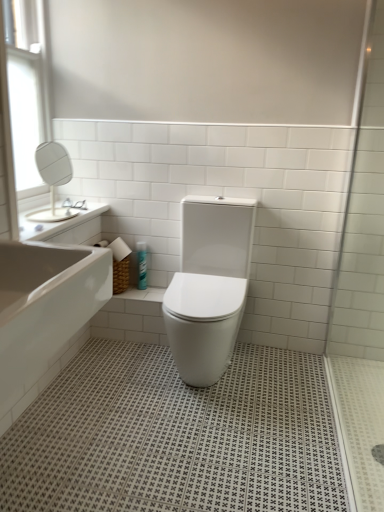
This screenshot has height=512, width=384. Identify the location of free space in front of blue glossy spray can at center. (145, 292).